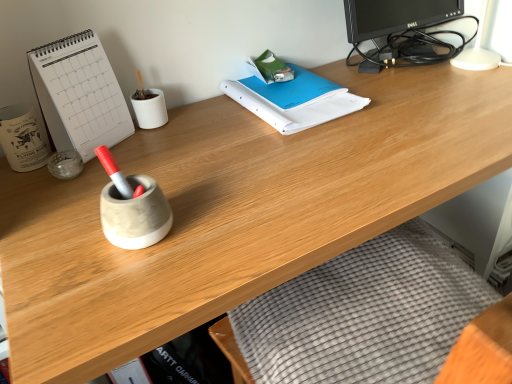
Question: Considering the relative sizes of blue paper binder at center and transparent glass jar at left, arranged as the 1th stationery when viewed from the right, in the image provided, is blue paper binder at center taller than transparent glass jar at left, arranged as the 1th stationery when viewed from the right,?

Choices:
 (A) yes
 (B) no

Answer: (B)

Question: Is blue paper binder at center in front of transparent glass jar at left, arranged as the 1th stationery when viewed from the right?

Choices:
 (A) yes
 (B) no

Answer: (B)

Question: Is transparent glass jar at left, which appears as the second stationery when viewed from the left, completely or partially inside blue paper binder at center?

Choices:
 (A) yes
 (B) no

Answer: (B)

Question: Does blue paper binder at center have a smaller size compared to transparent glass jar at left, which appears as the second stationery when viewed from the left?

Choices:
 (A) yes
 (B) no

Answer: (B)

Question: Does blue paper binder at center touch transparent glass jar at left, arranged as the 1th stationery when viewed from the right?

Choices:
 (A) yes
 (B) no

Answer: (B)

Question: Would you say transparent glass jar at left, which appears as the second stationery when viewed from the left, is to the left or to the right of white paper at left in the picture?

Choices:
 (A) right
 (B) left

Answer: (B)

Question: From the image's perspective, relative to white paper at left, is transparent glass jar at left, arranged as the 1th stationery when viewed from the right, above or below?

Choices:
 (A) below
 (B) above

Answer: (A)

Question: From a real-world perspective, is transparent glass jar at left, arranged as the 1th stationery when viewed from the right, above or below white paper at left?

Choices:
 (A) below
 (B) above

Answer: (A)

Question: From their relative heights in the image, would you say transparent glass jar at left, arranged as the 1th stationery when viewed from the right, is taller or shorter than white paper at left?

Choices:
 (A) short
 (B) tall

Answer: (A)

Question: In terms of height, does white ceramic mug at left, marked as the first stationery in a left-to-right arrangement, look taller or shorter compared to blue paper binder at center?

Choices:
 (A) short
 (B) tall

Answer: (B)

Question: Is white ceramic mug at left, which appears as the second stationery when viewed from the right, inside or outside of blue paper binder at center?

Choices:
 (A) outside
 (B) inside

Answer: (A)

Question: Looking at the image, does white ceramic mug at left, marked as the first stationery in a left-to-right arrangement, seem bigger or smaller compared to blue paper binder at center?

Choices:
 (A) small
 (B) big

Answer: (A)

Question: Is white ceramic mug at left, marked as the first stationery in a left-to-right arrangement, wider or thinner than blue paper binder at center?

Choices:
 (A) wide
 (B) thin

Answer: (B)

Question: From the image's perspective, is white paper at left positioned above or below blue paper binder at center?

Choices:
 (A) below
 (B) above

Answer: (A)

Question: From a real-world perspective, is white paper at left above or below blue paper binder at center?

Choices:
 (A) above
 (B) below

Answer: (A)